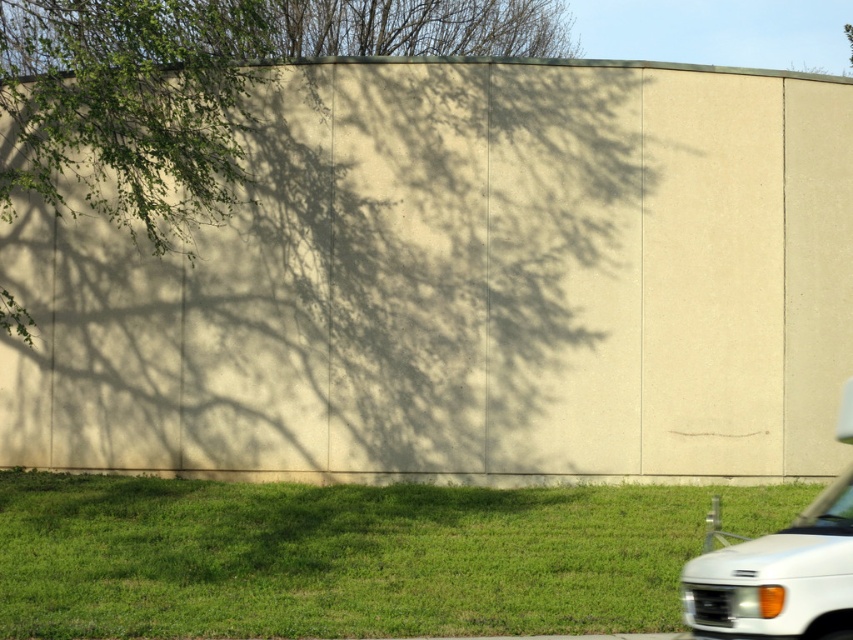
Question: Which point appears farthest from the camera in this image?

Choices:
 (A) (440, 561)
 (B) (228, 54)
 (C) (744, 621)
 (D) (10, 140)

Answer: (B)

Question: Which point appears farthest from the camera in this image?

Choices:
 (A) (119, 72)
 (B) (76, 92)
 (C) (833, 564)
 (D) (370, 556)

Answer: (B)

Question: Is green grass at lower right bigger than green leafy tree at upper left?

Choices:
 (A) no
 (B) yes

Answer: (A)

Question: Can you confirm if green grass at lower right is positioned above white matte van at lower right?

Choices:
 (A) no
 (B) yes

Answer: (A)

Question: Does green leafy tree at upper left have a greater width compared to green leafy branches at upper left?

Choices:
 (A) yes
 (B) no

Answer: (A)

Question: Among these objects, which one is nearest to the camera?

Choices:
 (A) green leafy branches at upper left
 (B) green grass at lower right
 (C) green leafy tree at upper left
 (D) white matte van at lower right

Answer: (D)